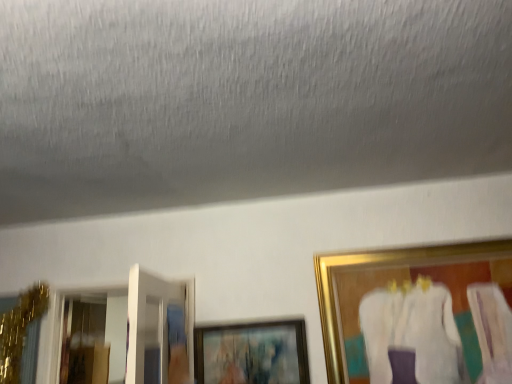
Describe the element at coordinates (400, 287) in the screenshot. I see `gold-framed painting at right, positioned as the second picture frame in left-to-right order` at that location.

Based on the photo, what is the approximate width of gold-framed painting at right, which is the first picture frame from right to left?

gold-framed painting at right, which is the first picture frame from right to left, is 4.24 inches in width.

In order to click on gold-framed painting at right, positioned as the second picture frame in left-to-right order in this screenshot , I will do `click(400, 287)`.

In order to face matte black picture frame at center, which ranks as the 2th picture frame in right-to-left order, should I rotate leftwards or rightwards?

You should rotate left by 0.738 degrees.

This screenshot has width=512, height=384. Find the location of `matte black picture frame at center, the first picture frame from the left`. matte black picture frame at center, the first picture frame from the left is located at coordinates (252, 353).

Describe the element at coordinates (252, 353) in the screenshot. This screenshot has height=384, width=512. I see `matte black picture frame at center, which ranks as the 2th picture frame in right-to-left order` at that location.

Image resolution: width=512 pixels, height=384 pixels. I want to click on gold-framed painting at right, which is the first picture frame from right to left, so click(400, 287).

Which object is positioned more to the left, matte black picture frame at center, the first picture frame from the left, or gold-framed painting at right, which is the first picture frame from right to left?

Positioned to the left is matte black picture frame at center, the first picture frame from the left.

Is the depth of matte black picture frame at center, the first picture frame from the left, less than that of gold-framed painting at right, which is the first picture frame from right to left?

That is False.

Is point (297, 366) less distant than point (381, 262)?

Yes, it is.

From the image's perspective, does matte black picture frame at center, the first picture frame from the left, appear lower than gold-framed painting at right, which is the first picture frame from right to left?

Yes, from the image's perspective, matte black picture frame at center, the first picture frame from the left, is beneath gold-framed painting at right, which is the first picture frame from right to left.

From a real-world perspective, is matte black picture frame at center, the first picture frame from the left, on top of gold-framed painting at right, positioned as the second picture frame in left-to-right order?

No, from a real-world perspective, matte black picture frame at center, the first picture frame from the left, is not over gold-framed painting at right, positioned as the second picture frame in left-to-right order

Which of these two, matte black picture frame at center, which ranks as the 2th picture frame in right-to-left order, or gold-framed painting at right, positioned as the second picture frame in left-to-right order, is thinner?

matte black picture frame at center, which ranks as the 2th picture frame in right-to-left order, is thinner.

Between matte black picture frame at center, which ranks as the 2th picture frame in right-to-left order, and gold-framed painting at right, which is the first picture frame from right to left, which one has less height?

matte black picture frame at center, which ranks as the 2th picture frame in right-to-left order, is shorter.

Can you confirm if matte black picture frame at center, which ranks as the 2th picture frame in right-to-left order, is bigger than gold-framed painting at right, positioned as the second picture frame in left-to-right order?

No.

Is matte black picture frame at center, which ranks as the 2th picture frame in right-to-left order, situated inside gold-framed painting at right, which is the first picture frame from right to left, or outside?

matte black picture frame at center, which ranks as the 2th picture frame in right-to-left order, is spatially situated outside gold-framed painting at right, which is the first picture frame from right to left.

Does matte black picture frame at center, the first picture frame from the left, touch gold-framed painting at right, positioned as the second picture frame in left-to-right order?

No, matte black picture frame at center, the first picture frame from the left, is not beside gold-framed painting at right, positioned as the second picture frame in left-to-right order.

Is matte black picture frame at center, the first picture frame from the left, turned away from gold-framed painting at right, which is the first picture frame from right to left?

That's not correct — matte black picture frame at center, the first picture frame from the left, is not looking away from gold-framed painting at right, which is the first picture frame from right to left.

What's the angular difference between matte black picture frame at center, which ranks as the 2th picture frame in right-to-left order, and gold-framed painting at right, positioned as the second picture frame in left-to-right order,'s facing directions?

0.399 degrees separate the facing orientations of matte black picture frame at center, which ranks as the 2th picture frame in right-to-left order, and gold-framed painting at right, positioned as the second picture frame in left-to-right order.

Image resolution: width=512 pixels, height=384 pixels. What are the coordinates of `picture frame on the right of matte black picture frame at center, which ranks as the 2th picture frame in right-to-left order` in the screenshot? It's located at (400, 287).

In the image, is gold-framed painting at right, which is the first picture frame from right to left, on the left side or the right side of matte black picture frame at center, the first picture frame from the left?

Based on their positions, gold-framed painting at right, which is the first picture frame from right to left, is located to the right of matte black picture frame at center, the first picture frame from the left.

Considering the relative positions of gold-framed painting at right, which is the first picture frame from right to left, and matte black picture frame at center, the first picture frame from the left, in the image provided, is gold-framed painting at right, which is the first picture frame from right to left, in front of matte black picture frame at center, the first picture frame from the left,?

Yes, gold-framed painting at right, which is the first picture frame from right to left, is closer to the camera.

Which is behind, point (335, 286) or point (227, 362)?

The point (335, 286) is more distant.

From the image's perspective, would you say gold-framed painting at right, which is the first picture frame from right to left, is positioned over matte black picture frame at center, which ranks as the 2th picture frame in right-to-left order?

Yes, from the image's perspective, gold-framed painting at right, which is the first picture frame from right to left, is above matte black picture frame at center, which ranks as the 2th picture frame in right-to-left order.

From a real-world perspective, which object stands above the other?

gold-framed painting at right, positioned as the second picture frame in left-to-right order, is physically above.

Considering the sizes of gold-framed painting at right, which is the first picture frame from right to left, and matte black picture frame at center, the first picture frame from the left, in the image, is gold-framed painting at right, which is the first picture frame from right to left, wider or thinner than matte black picture frame at center, the first picture frame from the left,?

gold-framed painting at right, which is the first picture frame from right to left, is wider than matte black picture frame at center, the first picture frame from the left.

Is gold-framed painting at right, which is the first picture frame from right to left, taller or shorter than matte black picture frame at center, the first picture frame from the left?

Considering their sizes, gold-framed painting at right, which is the first picture frame from right to left, has more height than matte black picture frame at center, the first picture frame from the left.

Consider the image. Considering the relative sizes of gold-framed painting at right, which is the first picture frame from right to left, and matte black picture frame at center, which ranks as the 2th picture frame in right-to-left order, in the image provided, is gold-framed painting at right, which is the first picture frame from right to left, bigger than matte black picture frame at center, which ranks as the 2th picture frame in right-to-left order,?

Indeed, gold-framed painting at right, which is the first picture frame from right to left, has a larger size compared to matte black picture frame at center, which ranks as the 2th picture frame in right-to-left order.

Is gold-framed painting at right, positioned as the second picture frame in left-to-right order, located outside matte black picture frame at center, which ranks as the 2th picture frame in right-to-left order?

Yes, gold-framed painting at right, positioned as the second picture frame in left-to-right order, is located beyond the bounds of matte black picture frame at center, which ranks as the 2th picture frame in right-to-left order.

Can you see gold-framed painting at right, positioned as the second picture frame in left-to-right order, touching matte black picture frame at center, the first picture frame from the left?

There is a gap between gold-framed painting at right, positioned as the second picture frame in left-to-right order, and matte black picture frame at center, the first picture frame from the left.

Could you tell me if gold-framed painting at right, positioned as the second picture frame in left-to-right order, is facing matte black picture frame at center, the first picture frame from the left?

No, gold-framed painting at right, positioned as the second picture frame in left-to-right order, is not aimed at matte black picture frame at center, the first picture frame from the left.

How many degrees apart are the facing directions of gold-framed painting at right, which is the first picture frame from right to left, and matte black picture frame at center, the first picture frame from the left?

They differ by 0.399 degrees in their facing directions.

This screenshot has width=512, height=384. I want to click on picture frame on the right of matte black picture frame at center, which ranks as the 2th picture frame in right-to-left order, so click(400, 287).

Where is `picture frame on the right of matte black picture frame at center, which ranks as the 2th picture frame in right-to-left order`? picture frame on the right of matte black picture frame at center, which ranks as the 2th picture frame in right-to-left order is located at coordinates (400, 287).

In order to click on picture frame that appears below the gold-framed painting at right, which is the first picture frame from right to left (from the image's perspective) in this screenshot , I will do `click(252, 353)`.